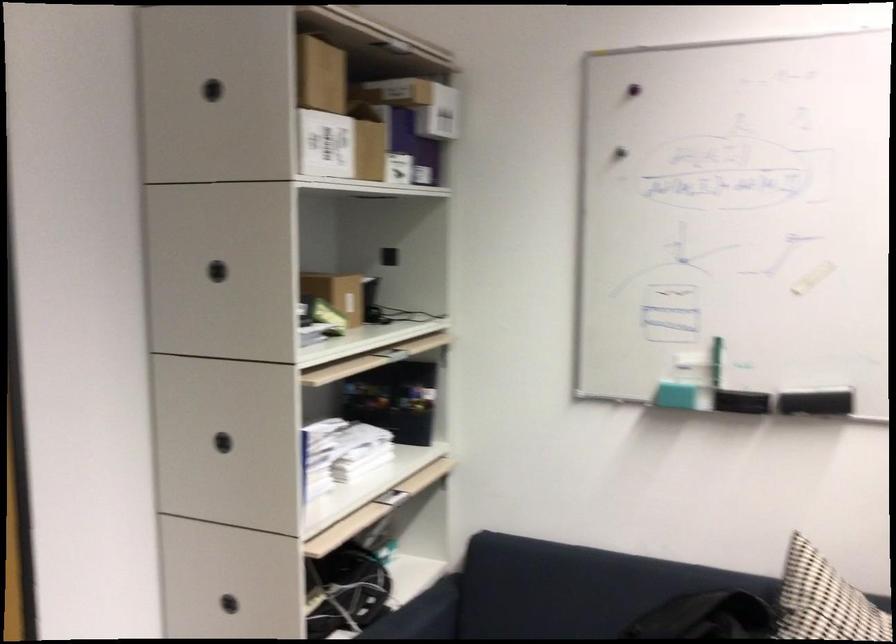
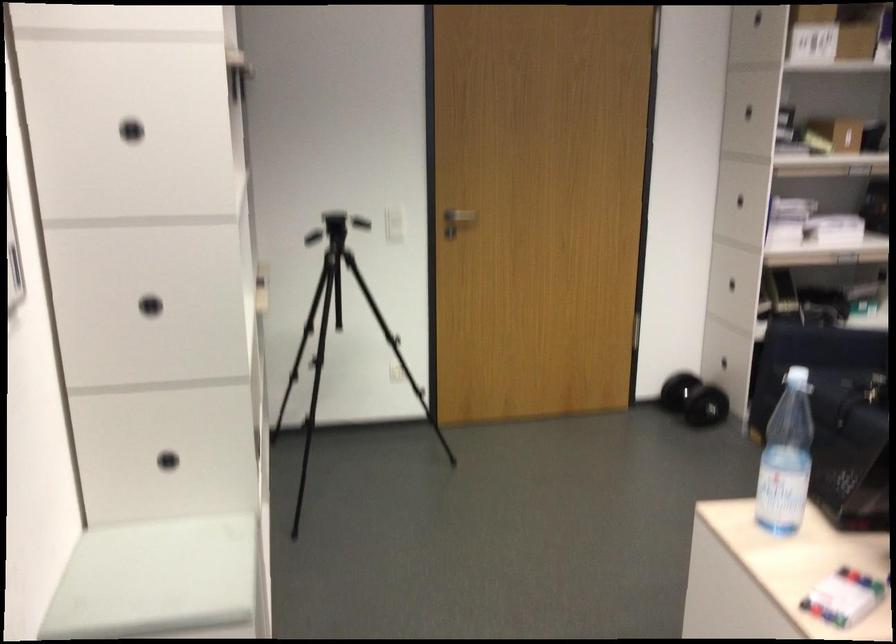
Where in the second image is the point corresponding to point (222, 269) from the first image?

(747, 111)